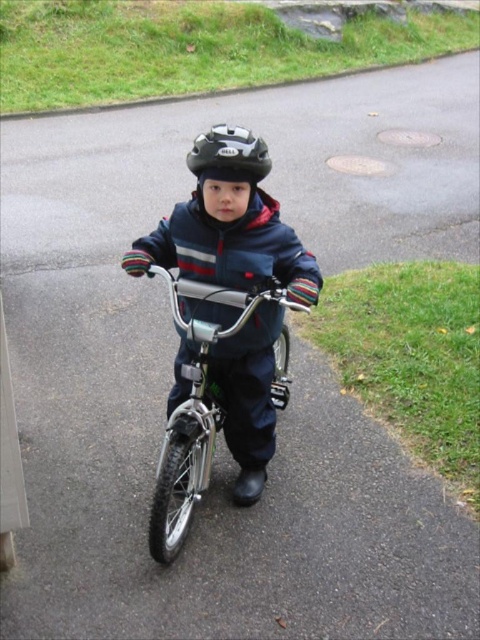
You are a parent trying to secure your child with a safety strap between the shiny metallic bicycle at center and the matte black helmet at center. The strap can only stretch up to 30 inches. Will the strap be long enough?

The shiny metallic bicycle at center and the matte black helmet at center are 28.92 inches apart from each other. Since the strap can stretch up to 30 inches, the strap will be long enough to secure the child.

You are a parent trying to decide if your child can ride the shiny metallic bicycle at center while wearing the matte black helmet at center. Based on the size of the bicycle and helmet, will the helmet fit properly?

The shiny metallic bicycle at center has a larger width than the matte black helmet at center, but the helmet size depends on head measurements. Since the bicycle is wider, it doesn not directly affect helmet fit. The matte black helmet at center should fit if it matches the child head size.

Based on the photo, you are a photographer trying to capture a clear photo of the shiny metallic bicycle at center and the matte black helmet at center. Since you want both objects in focus, which one should you adjust your camera focus to prioritize based on their positions?

The shiny metallic bicycle at center is closer to the viewer than the matte black helmet at center, so you should prioritize focusing on the bicycle first as it is nearer. However, in photography, if both need to be in focus, using a smaller aperture or adjusting the focal point to the hyperfocal distance might be better.